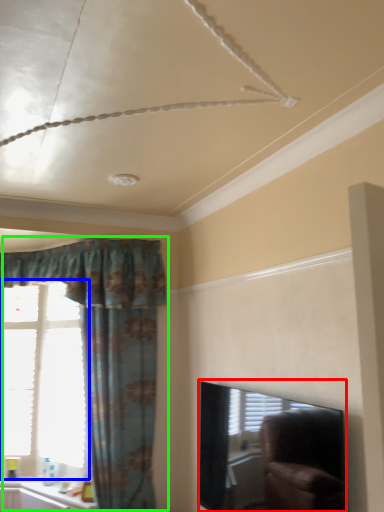
Question: Considering the real-world distances, which object is closest to window screen (highlighted by a red box)? window (highlighted by a blue box) or curtain (highlighted by a green box).

Choices:
 (A) window
 (B) curtain

Answer: (B)